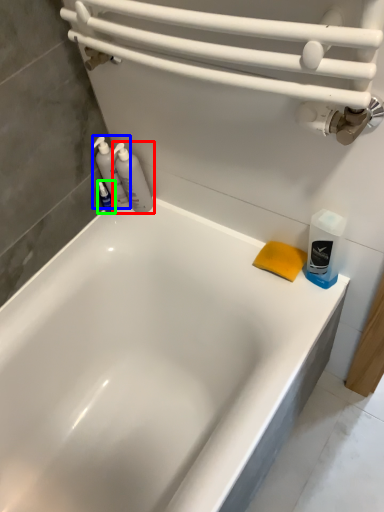
Question: Which object is positioned closest to cleaning product (highlighted by a red box)? Select from cleaning product (highlighted by a blue box) and toiletry (highlighted by a green box).

Choices:
 (A) cleaning product
 (B) toiletry

Answer: (A)